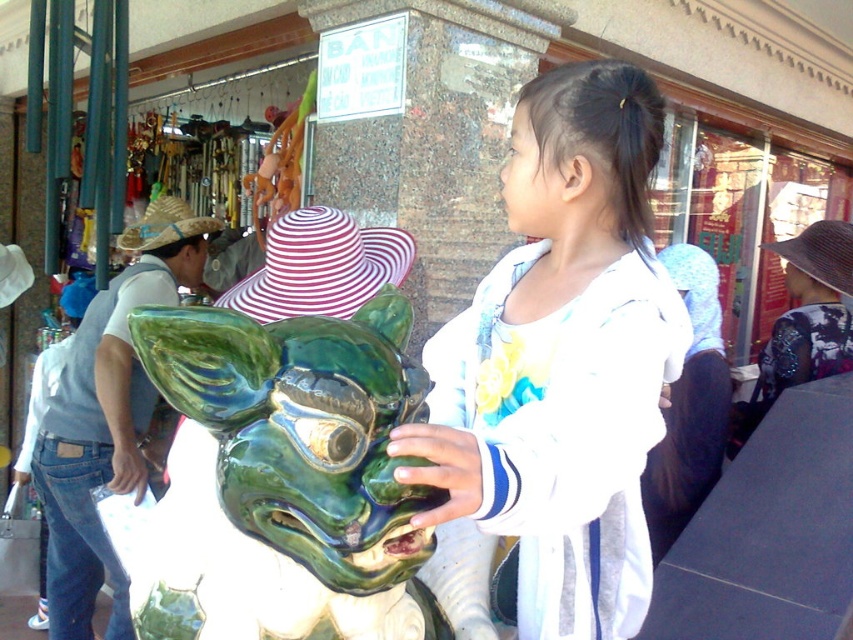
What is the object located at the coordinates point (x=556, y=371)?

The object located at point (x=556, y=371) is the white matte shirt at center.

You are standing in the market scene and want to take a photo of the point at coordinates (445, 438). The camera you are using has a minimum focus distance of 30 inches. Will the point be in focus?

The point at coordinates (445, 438) is 33.59 inches from the viewer, which is beyond the camera minimum focus distance of 30 inches. Therefore, the point will be in focus.

You are a customer in the market and want to buy the white matte shirt at center. Where should you look to find it?

The white matte shirt at center is located at point (x=556, y=371), so you should look in the center of the image to find it.